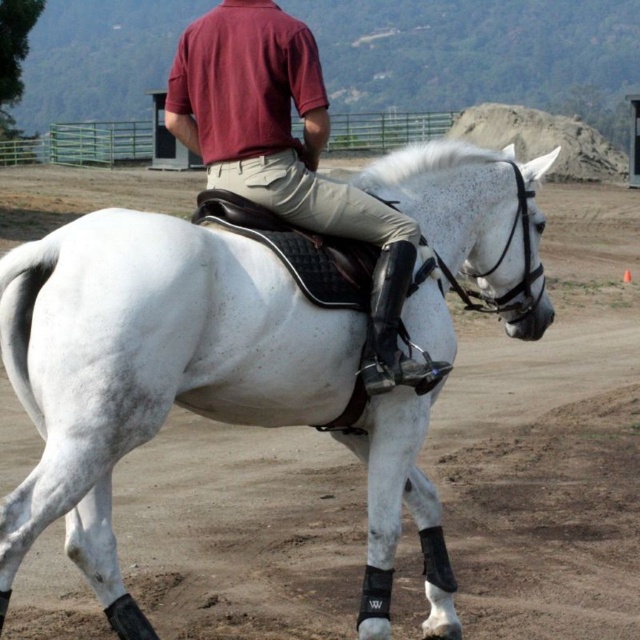
In the scene shown: Does white matte/suede horse at center appear on the right side of matte red polo shirt at upper center?

Incorrect, white matte/suede horse at center is not on the right side of matte red polo shirt at upper center.

Looking at this image, does white matte/suede horse at center have a larger size compared to matte red polo shirt at upper center?

Indeed, white matte/suede horse at center has a larger size compared to matte red polo shirt at upper center.

I want to click on white matte/suede horse at center, so 148,365.